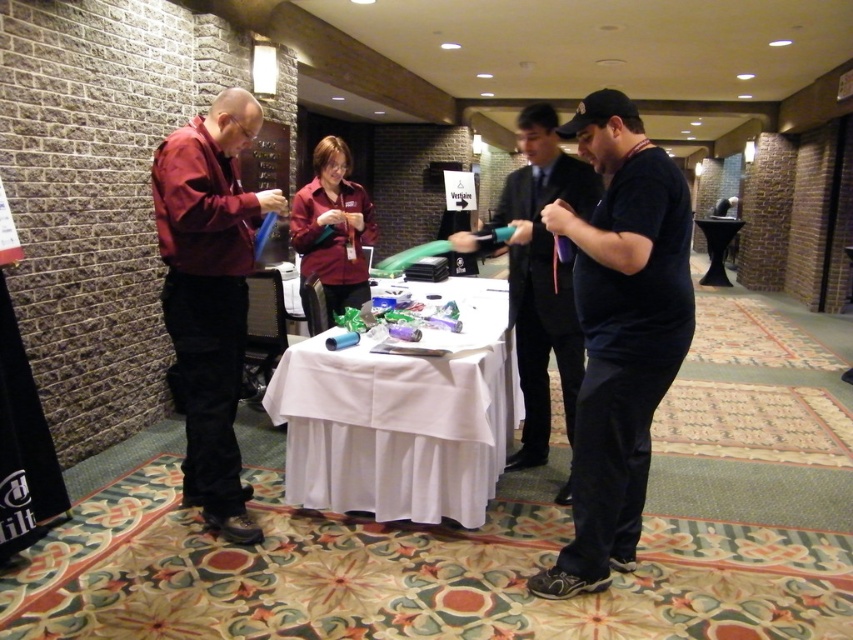
Question: Which point appears farthest from the camera in this image?

Choices:
 (A) (258, 218)
 (B) (294, 410)

Answer: (B)

Question: Does black matte shirt at center have a smaller size compared to black matte shirt at right?

Choices:
 (A) yes
 (B) no

Answer: (A)

Question: Observing the image, what is the correct spatial positioning of black matte shirt at center in reference to white cloth-covered table at center?

Choices:
 (A) below
 (B) above

Answer: (B)

Question: Which object appears closest to the camera in this image?

Choices:
 (A) white cloth-covered table at center
 (B) black matte shirt at right
 (C) black matte shirt at center
 (D) matte maroon shirt at left

Answer: (C)

Question: Is black matte shirt at center wider than matte maroon shirt at left?

Choices:
 (A) yes
 (B) no

Answer: (A)

Question: Which object is farther from the camera taking this photo?

Choices:
 (A) matte maroon shirt at left
 (B) white cloth-covered table at center
 (C) black matte shirt at center
 (D) matte maroon shirt at center

Answer: (D)